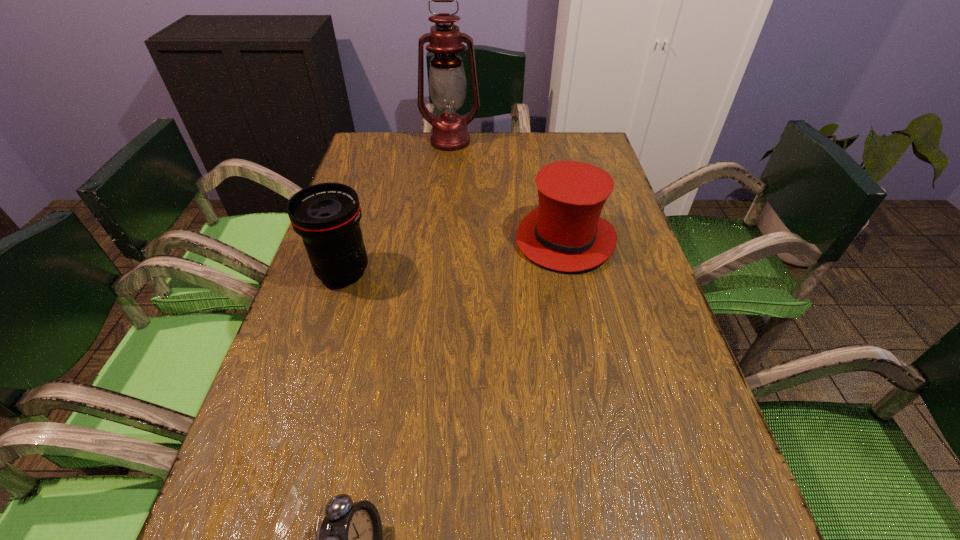
At what (x,y) coordinates should I click in order to perform the action: click on object located in the right edge section of the desktop. Please return your answer as a coordinate pair (x, y). Image resolution: width=960 pixels, height=540 pixels. Looking at the image, I should click on (565, 232).

Where is `vacant area at the far edge of the desktop`? This screenshot has width=960, height=540. vacant area at the far edge of the desktop is located at coordinates (425, 132).

I want to click on free region at the left edge of the desktop, so click(x=317, y=363).

Find the location of a particular element. The width and height of the screenshot is (960, 540). vacant space at the right edge of the desktop is located at coordinates (623, 361).

You are a GUI agent. You are given a task and a screenshot of the screen. Output one action in this format:
    pyautogui.click(x=<x>, y=<y>)
    Task: Click on the vacant space at the far right corner
    This screenshot has width=960, height=540.
    Given the screenshot: What is the action you would take?
    [x=556, y=148]

The width and height of the screenshot is (960, 540). I want to click on empty space between the oil lamp and the hat, so click(x=508, y=190).

Locate an element on the screen. This screenshot has height=540, width=960. free spot between the hat and the tallest object is located at coordinates (508, 190).

Locate an element on the screen. This screenshot has height=540, width=960. free space between the rightmost object and the telephoto lens is located at coordinates (x=454, y=256).

Where is `vacant space in between the telephoto lens and the tallest object`? This screenshot has height=540, width=960. vacant space in between the telephoto lens and the tallest object is located at coordinates (396, 207).

Identify the location of vacant space that's between the leftmost object and the oil lamp. The height and width of the screenshot is (540, 960). [396, 207].